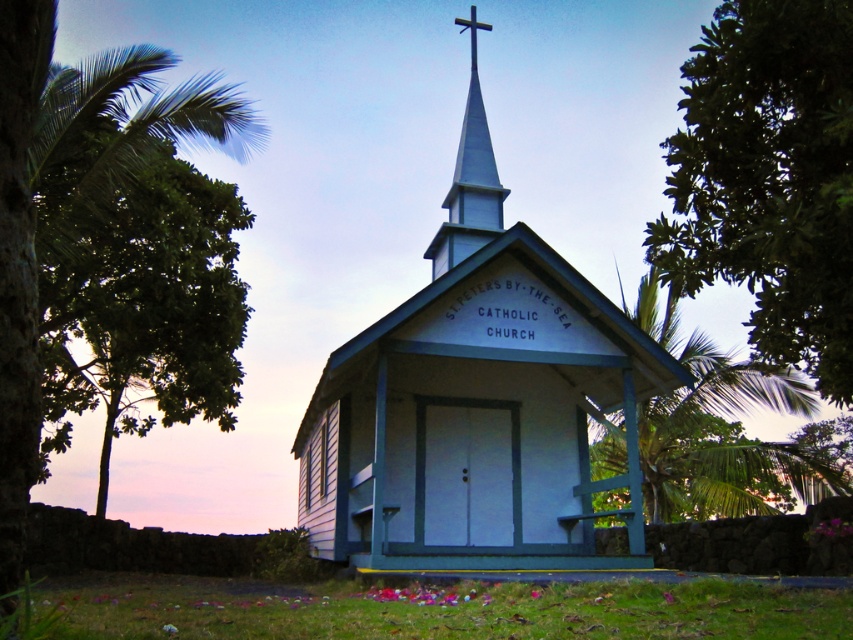
Question: From the image, what is the correct spatial relationship of white wood chapel at center in relation to green leafy palm tree at upper center?

Choices:
 (A) left
 (B) right

Answer: (A)

Question: Which object is positioned farthest from the green leafy palm tree at upper center?

Choices:
 (A) white smooth steeple at center
 (B) metallic cross at upper center

Answer: (B)

Question: Which point is farther from the camera taking this photo?

Choices:
 (A) (714, 493)
 (B) (473, 20)
 (C) (440, 451)
 (D) (666, 195)

Answer: (B)

Question: Does white wood chapel at center have a larger size compared to white smooth steeple at center?

Choices:
 (A) yes
 (B) no

Answer: (A)

Question: Estimate the real-world distances between objects in this image. Which object is closer to the green leafy tree at upper right?

Choices:
 (A) green leafy palm tree at upper center
 (B) metallic cross at upper center

Answer: (B)

Question: In this image, where is white wood chapel at center located relative to metallic cross at upper center?

Choices:
 (A) left
 (B) right

Answer: (A)